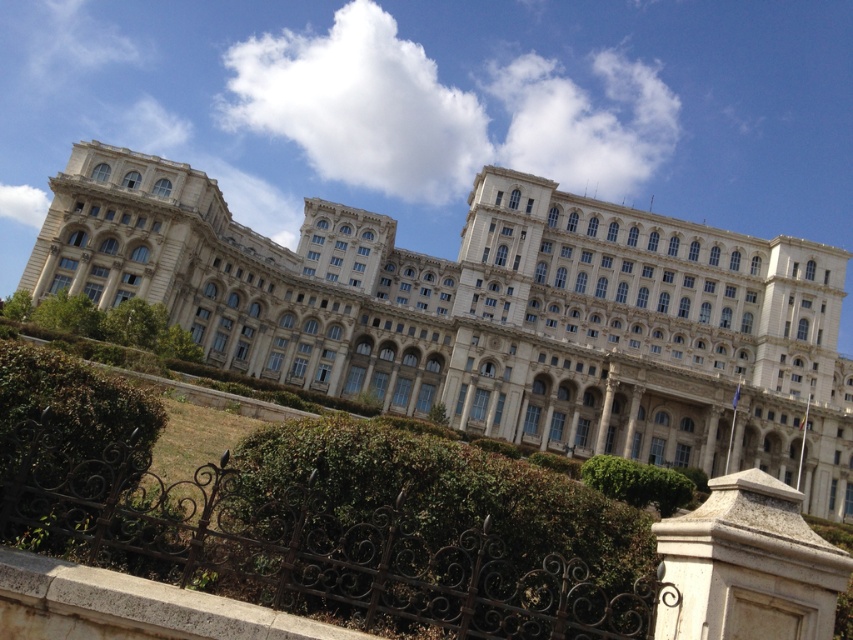
You are standing at the point marked as point (531,305) in the image. A friend is located 106.71 meters away from you. Where is your friend relative to your position?

Your friend is located 106.71 meters away from point (531,305).

Consider the image. You are standing in the garden area looking towards the grand building. Which object, the white stone building at center or the green leafy hedge at lower left, is positioned higher relative to your viewpoint?

The white stone building at center is positioned higher than the green leafy hedge at lower left because it is located above it in the scene.

You are standing in front of the grand building and want to know the exact location of the green leafy hedge at lower center. Based on the coordinate system where the bottom left corner is the origin, can you determine its position?

The green leafy hedge at lower center is located at point [451,492], which means it is positioned approximately 77.0 percent from the left edge and 53.1 percent from the bottom edge of the image.